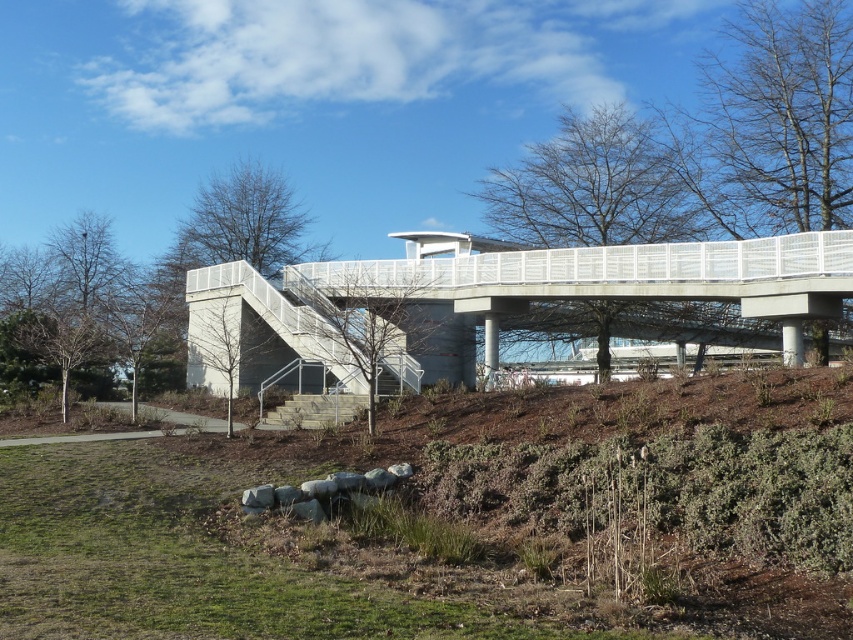
Question: Among these objects, which one is nearest to the camera?

Choices:
 (A) wooden stairs at center
 (B) white metallic pedestrian bridge at center

Answer: (B)

Question: Does white metallic pedestrian bridge at center appear on the right side of wooden stairs at center?

Choices:
 (A) yes
 (B) no

Answer: (A)

Question: Which object appears closest to the camera in this image?

Choices:
 (A) white metallic pedestrian bridge at center
 (B) wooden stairs at center

Answer: (A)

Question: Which point is closer to the camera taking this photo?

Choices:
 (A) (305, 406)
 (B) (686, 326)

Answer: (A)

Question: Observing the image, what is the correct spatial positioning of white metallic pedestrian bridge at center in reference to wooden stairs at center?

Choices:
 (A) left
 (B) right

Answer: (B)

Question: Can you confirm if white metallic pedestrian bridge at center is smaller than wooden stairs at center?

Choices:
 (A) yes
 (B) no

Answer: (B)